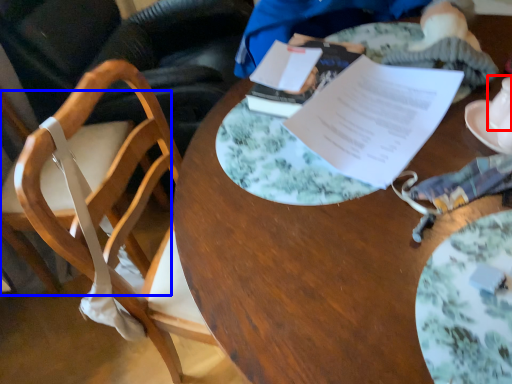
Question: Which object is closer to the camera taking this photo, tableware (highlighted by a red box) or chair (highlighted by a blue box)?

Choices:
 (A) tableware
 (B) chair

Answer: (B)